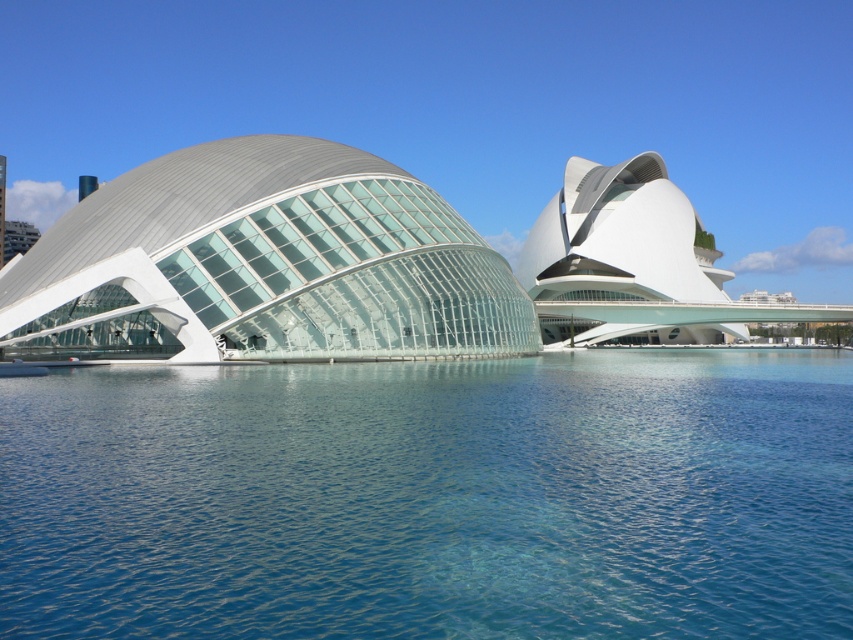
Is point (158, 392) farther from camera compared to point (100, 234)?

No, it is not.

Can you confirm if transparent blue water at center is thinner than transparent glass dome at left?

No, transparent blue water at center is not thinner than transparent glass dome at left.

Locate an element on the screen. Image resolution: width=853 pixels, height=640 pixels. transparent blue water at center is located at coordinates click(x=432, y=499).

You are a GUI agent. You are given a task and a screenshot of the screen. Output one action in this format:
    pyautogui.click(x=<x>, y=<y>)
    Task: Click on the transparent blue water at center
    
    Given the screenshot: What is the action you would take?
    pyautogui.click(x=432, y=499)